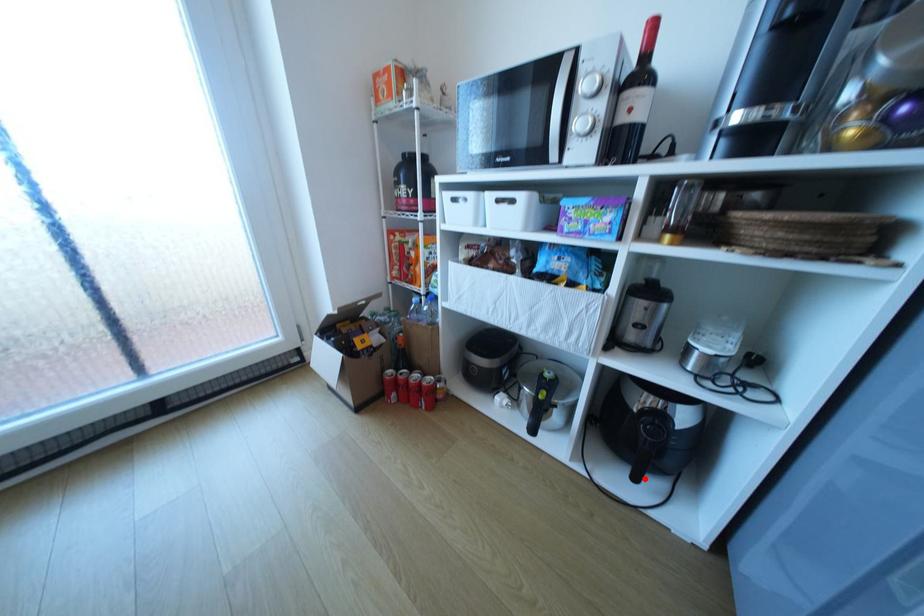
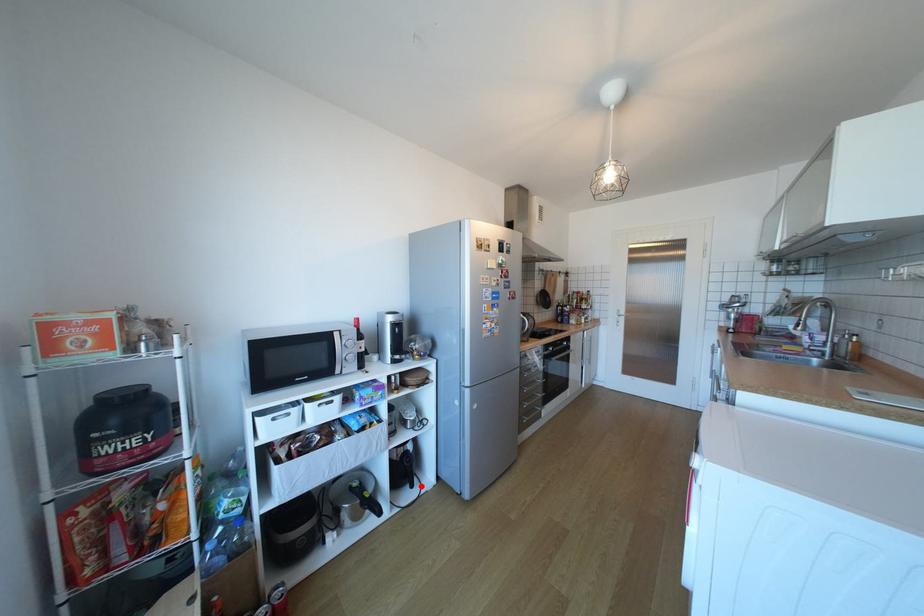
I am providing you with two images of the same scene from different viewpoints. A red point is marked on the first image and another point is marked on the second image. Do the highlighted points in image1 and image2 indicate the same real-world spot?

Yes